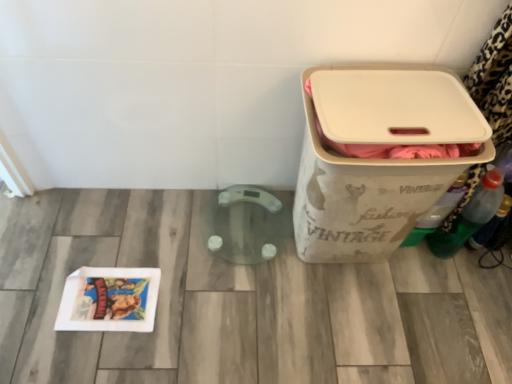
Image resolution: width=512 pixels, height=384 pixels. What are the coordinates of `space that is in front of green plastic bottle at right, arranged as the second bottle when viewed from the right` in the screenshot? It's located at (456, 292).